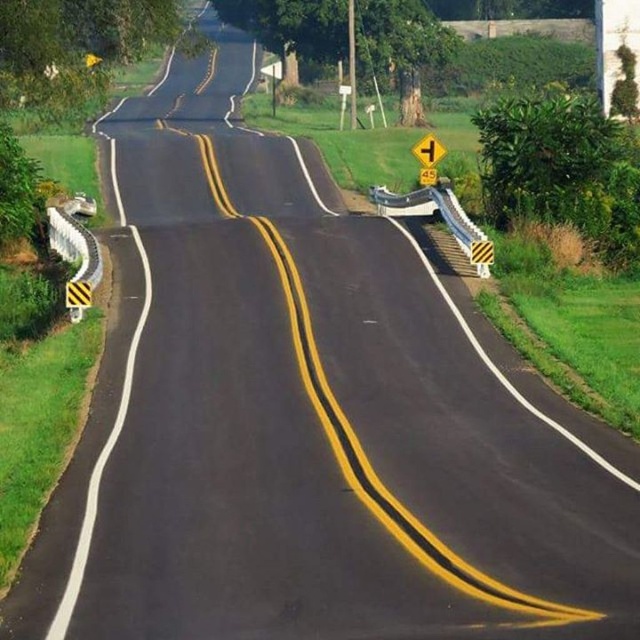
You are driving a car and see the yellow plastic sign at upper center and the yellow striped traffic sign at center. Which one is bigger?

The yellow plastic sign at upper center is larger in size than the yellow striped traffic sign at center.

You are a driver approaching the yellow plastic sign at upper center and the yellow striped traffic sign at center on a curving road. Which sign is located to the right side of the other?

The yellow plastic sign at upper center is positioned on the right side of yellow striped traffic sign at center.